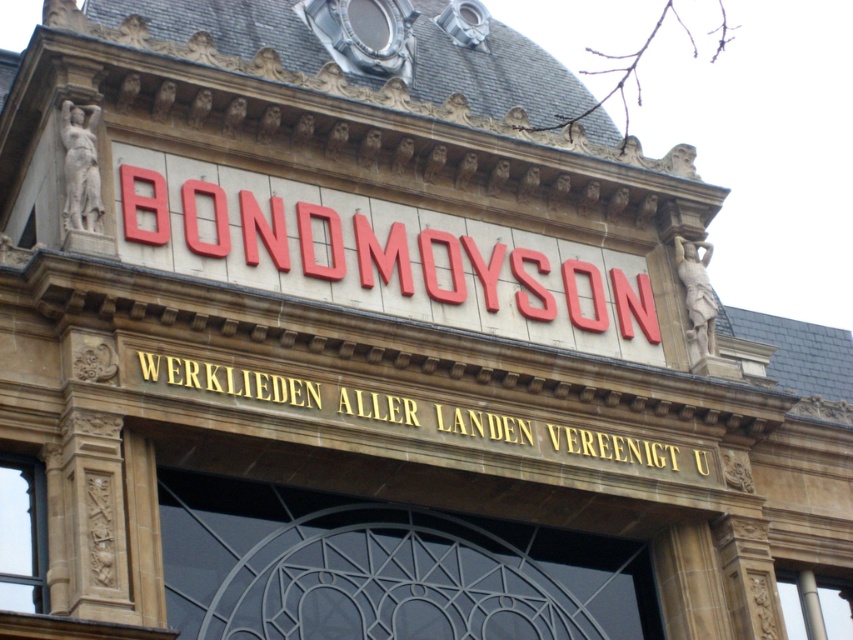
Question: Among these objects, which one is nearest to the camera?

Choices:
 (A) goldmaterial/textureinscription at center
 (B) red plastic sign at center

Answer: (A)

Question: Does red plastic sign at center have a greater width compared to goldmaterial/textureinscription at center?

Choices:
 (A) no
 (B) yes

Answer: (B)

Question: Can you confirm if red plastic sign at center is positioned to the right of goldmaterial/textureinscription at center?

Choices:
 (A) yes
 (B) no

Answer: (B)

Question: From the image, what is the correct spatial relationship of red plastic sign at center in relation to goldmaterial/textureinscription at center?

Choices:
 (A) left
 (B) right

Answer: (A)